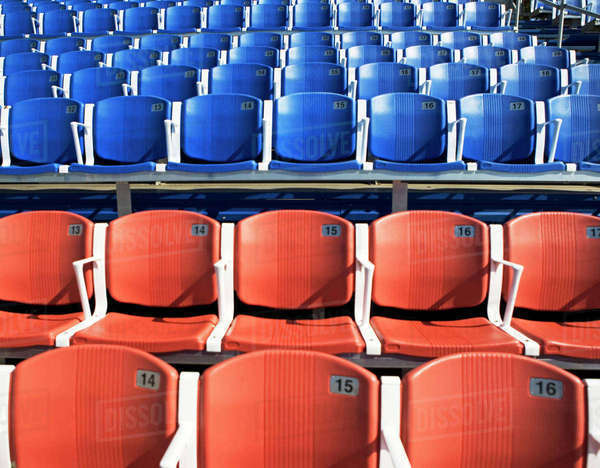
Locate an element on the screen. This screenshot has width=600, height=468. red seat arm rests is located at coordinates coord(98,252), coord(229,250), coord(362,244), coord(497,248), coord(595,400), coord(388,404), coord(187,397), coord(4,379).